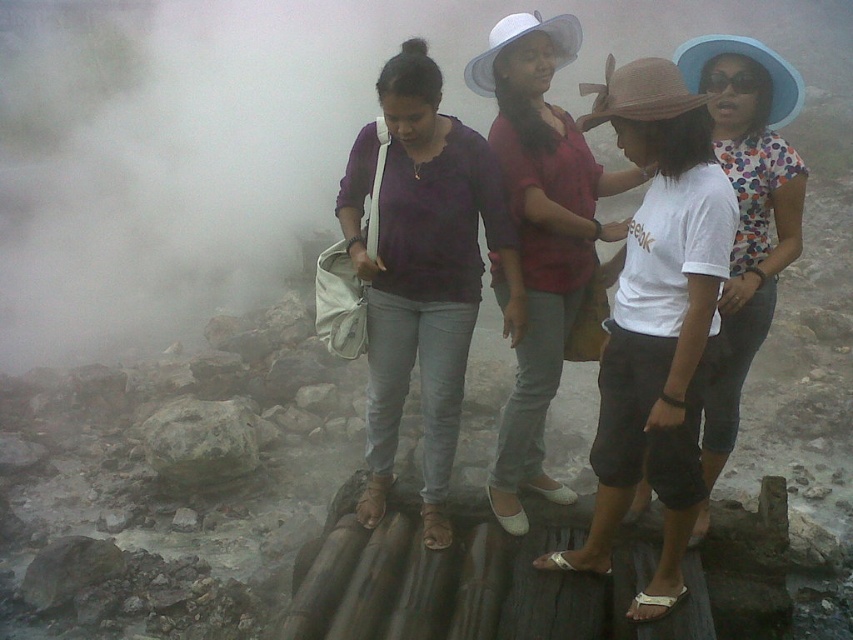
Is white mist at foggy center shorter than matte purple blouse at center?

No.

You are a GUI agent. You are given a task and a screenshot of the screen. Output one action in this format:
    pyautogui.click(x=<x>, y=<y>)
    Task: Click on the white mist at foggy center
    Image resolution: width=853 pixels, height=640 pixels.
    Given the screenshot: What is the action you would take?
    pyautogui.click(x=260, y=136)

Is point (608, 109) less distant than point (432, 378)?

That is True.

Between point (605, 451) and point (375, 468), which one is positioned behind?

The point (375, 468) is more distant.

You are a GUI agent. You are given a task and a screenshot of the screen. Output one action in this format:
    pyautogui.click(x=<x>, y=<y>)
    Task: Click on the white matte shirt at center
    Image resolution: width=853 pixels, height=640 pixels.
    Given the screenshot: What is the action you would take?
    coord(656,320)

Locate an element on the screen. The height and width of the screenshot is (640, 853). white matte shirt at center is located at coordinates (656, 320).

Does point (366, 268) lie behind point (740, 310)?

No, it is in front of (740, 310).

Is matte purple blouse at center positioned behind white cotton shirt at center?

Yes.

Which is in front, point (506, 333) or point (744, 97)?

Point (506, 333) is in front.

This screenshot has width=853, height=640. I want to click on matte purple blouse at center, so tap(422, 273).